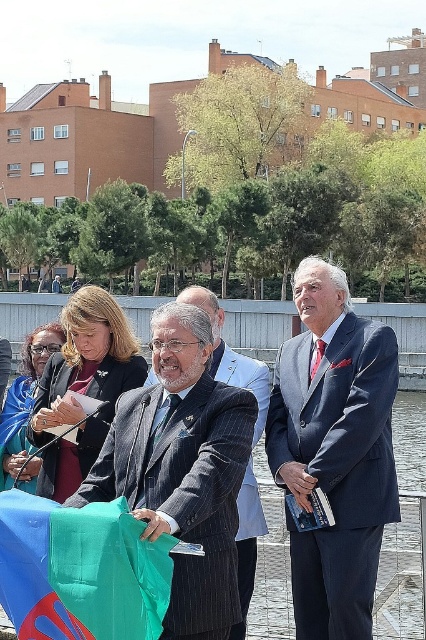
Between point (186, 586) and point (261, 410), which one is positioned behind?

Point (261, 410)

Does pinstriped wool suit at center have a lesser width compared to striped wool suit at center?

Yes.

Which is behind, point (213, 595) or point (241, 496)?

Positioned behind is point (241, 496).

The width and height of the screenshot is (426, 640). Identify the location of pinstriped wool suit at center. (184, 492).

Consider the image. Does matte blue suit at center have a smaller size compared to striped wool suit at center?

Indeed, matte blue suit at center has a smaller size compared to striped wool suit at center.

Between point (304, 538) and point (241, 483), which one is positioned in front?

Positioned in front is point (241, 483).

Does point (379, 436) come closer to viewer compared to point (149, 380)?

Yes, it is in front of point (149, 380).

Identify the location of matte blue suit at center. The image size is (426, 640). (x=333, y=452).

Which is behind, point (111, 534) or point (236, 548)?

Point (236, 548)

Which of these two, green fabric flag at lower left or striped wool suit at center, stands taller?

striped wool suit at center

The height and width of the screenshot is (640, 426). What do you see at coordinates (80, 570) in the screenshot?
I see `green fabric flag at lower left` at bounding box center [80, 570].

You are a GUI agent. You are given a task and a screenshot of the screen. Output one action in this format:
    pyautogui.click(x=<x>, y=<y>)
    Task: Click on the green fabric flag at lower left
    Image resolution: width=426 pixels, height=640 pixels.
    Given the screenshot: What is the action you would take?
    pyautogui.click(x=80, y=570)